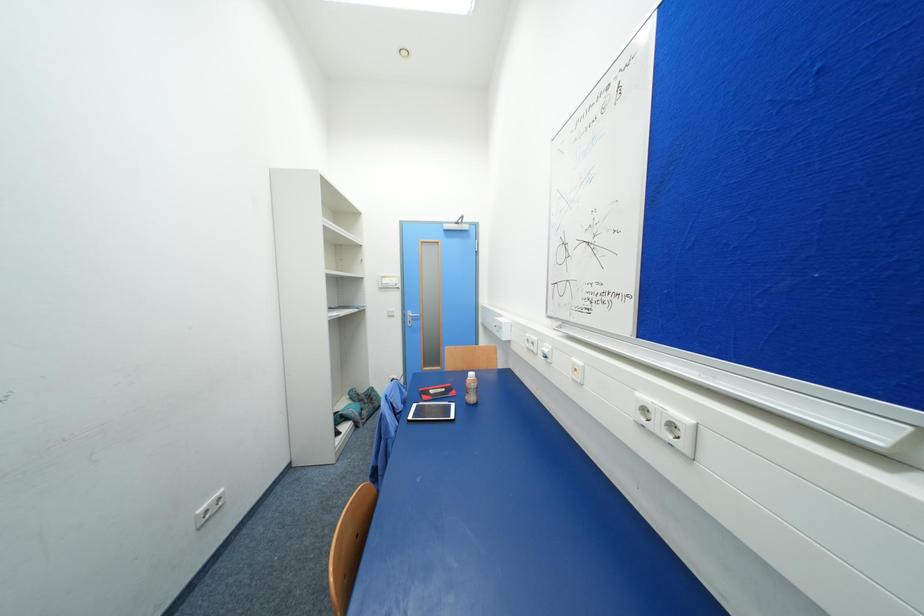
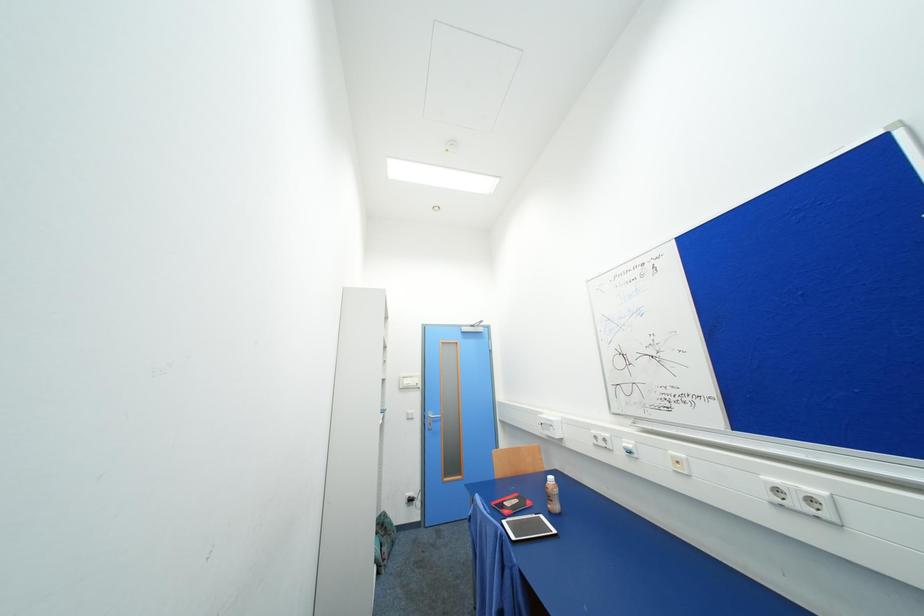
Question: What movement of the cameraman would produce the second image?

Choices:
 (A) Left
 (B) Right
 (C) Forward
 (D) Backward

Answer: (A)